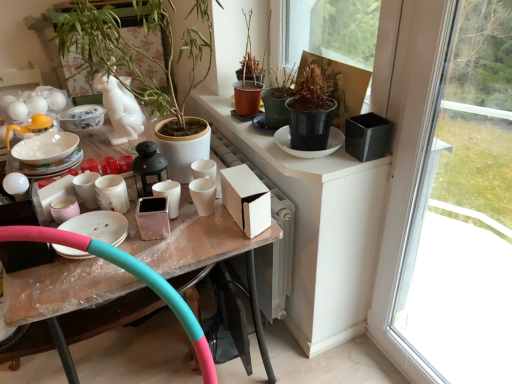
Question: Is matte white teapot at upper left located outside pink rubber garden hose at lower left?

Choices:
 (A) no
 (B) yes

Answer: (B)

Question: Is the depth of matte white teapot at upper left greater than that of pink rubber garden hose at lower left?

Choices:
 (A) no
 (B) yes

Answer: (B)

Question: Can you confirm if matte white teapot at upper left is positioned to the right of pink rubber garden hose at lower left?

Choices:
 (A) no
 (B) yes

Answer: (A)

Question: From the image's perspective, is matte white teapot at upper left beneath pink rubber garden hose at lower left?

Choices:
 (A) no
 (B) yes

Answer: (A)

Question: Is matte white teapot at upper left looking in the opposite direction of pink rubber garden hose at lower left?

Choices:
 (A) no
 (B) yes

Answer: (A)

Question: Looking at their shapes, would you say transparent glass window at right is wider or thinner than matte pink ceramic cup at center, the third tableware from the left?

Choices:
 (A) thin
 (B) wide

Answer: (B)

Question: Is transparent glass window at right in front of or behind matte pink ceramic cup at center, marked as the 1th tableware in a right-to-left arrangement, in the image?

Choices:
 (A) front
 (B) behind

Answer: (A)

Question: Is point (448, 339) positioned closer to the camera than point (163, 187)?

Choices:
 (A) closer
 (B) farther

Answer: (B)

Question: Is transparent glass window at right inside or outside of matte pink ceramic cup at center, the third tableware from the left?

Choices:
 (A) inside
 (B) outside

Answer: (B)

Question: Which is correct: pink rubber garden hose at lower left is inside green matte plant at upper left, the 1th houseplant positioned from the left, or outside of it?

Choices:
 (A) inside
 (B) outside

Answer: (B)

Question: Is point (15, 240) closer or farther from the camera than point (197, 36)?

Choices:
 (A) farther
 (B) closer

Answer: (B)

Question: From a real-world perspective, is pink rubber garden hose at lower left positioned above or below green matte plant at upper left, the 1th houseplant positioned from the left?

Choices:
 (A) above
 (B) below

Answer: (B)

Question: In terms of height, does pink rubber garden hose at lower left look taller or shorter compared to green matte plant at upper left, acting as the 2th houseplant starting from the right?

Choices:
 (A) tall
 (B) short

Answer: (B)

Question: Considering the relative positions of matte white teapot at upper left and green matte plant at upper left, the 1th houseplant positioned from the left, in the image provided, is matte white teapot at upper left to the left or to the right of green matte plant at upper left, the 1th houseplant positioned from the left,?

Choices:
 (A) right
 (B) left

Answer: (B)

Question: Relative to green matte plant at upper left, acting as the 2th houseplant starting from the right, is matte white teapot at upper left in front or behind?

Choices:
 (A) behind
 (B) front

Answer: (A)